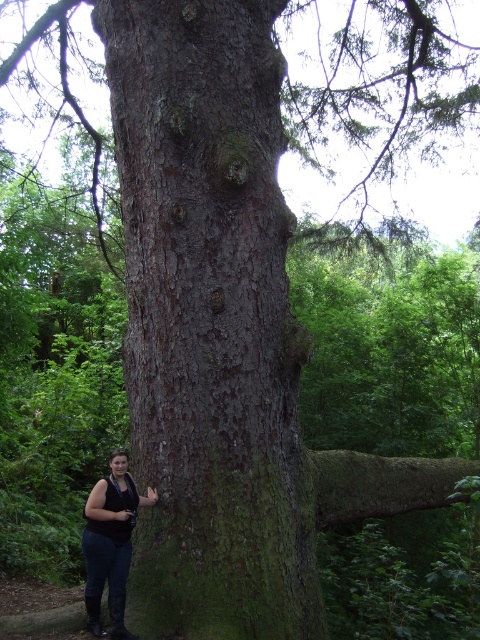
Is dark brown rough bark at center shorter than matte black vest at lower left?

Incorrect, dark brown rough bark at center's height does not fall short of matte black vest at lower left's.

Is point (133, 467) closer to camera compared to point (123, 582)?

No.

Which is in front, point (276, 593) or point (87, 580)?

Point (276, 593) is more forward.

Identify the location of dark brown rough bark at center. The image size is (480, 640). (211, 320).